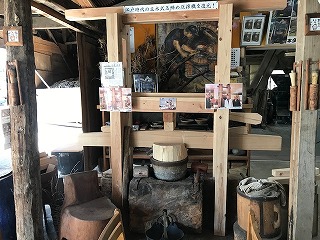
This screenshot has height=240, width=320. Identify the location of wooden wall container holder. (294, 95), (314, 94).